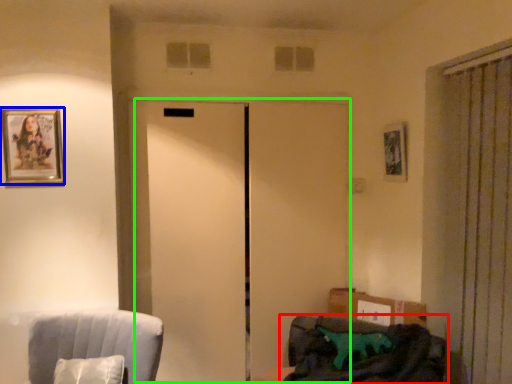
Question: Which object is positioned farthest from furniture (highlighted by a red box)? Select from picture frame (highlighted by a blue box) and elevator (highlighted by a green box).

Choices:
 (A) picture frame
 (B) elevator

Answer: (A)